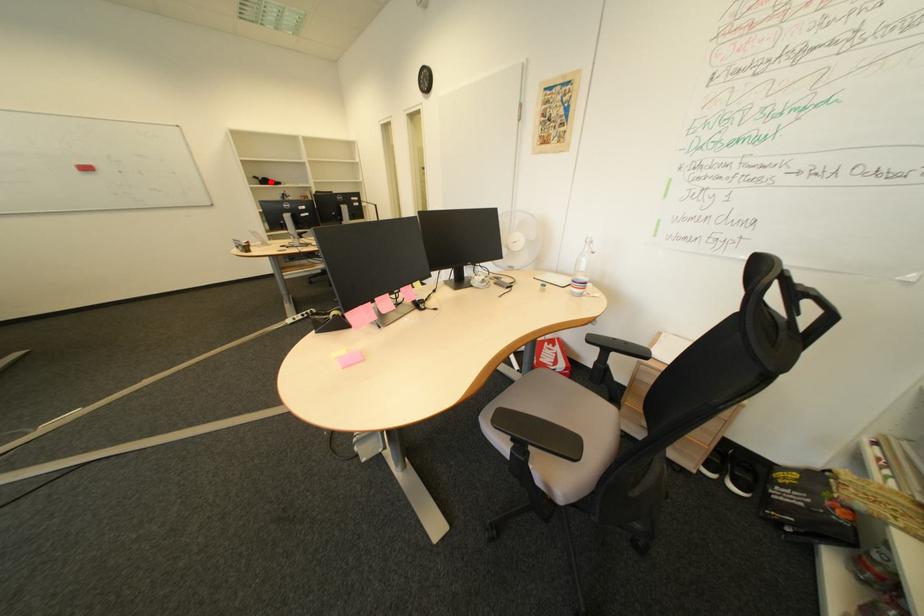
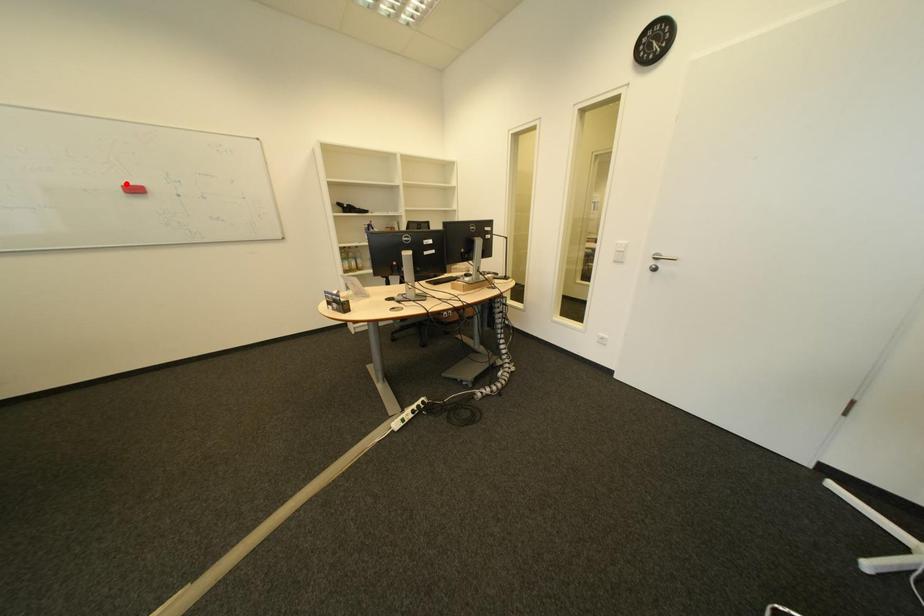
I am providing you with two images of the same scene from different viewpoints. A red point is marked on the first image and another point is marked on the second image. Do the highlighted points in image1 and image2 indicate the same real-world spot?

No